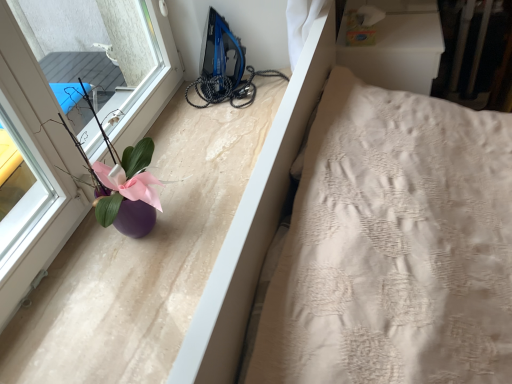
Question: Considering the positions of point (130, 175) and point (1, 59), is point (130, 175) closer or farther from the camera than point (1, 59)?

Choices:
 (A) closer
 (B) farther

Answer: (B)

Question: In terms of width, does purple glossy vase at left look wider or thinner when compared to purple matte vase at left?

Choices:
 (A) thin
 (B) wide

Answer: (B)

Question: From a real-world perspective, is purple glossy vase at left physically located above or below purple matte vase at left?

Choices:
 (A) below
 (B) above

Answer: (A)

Question: Does point (32, 97) appear closer or farther from the camera than point (110, 188)?

Choices:
 (A) closer
 (B) farther

Answer: (A)

Question: Relative to purple glossy vase at left, is purple matte vase at left in front or behind?

Choices:
 (A) front
 (B) behind

Answer: (A)

Question: Is purple matte vase at left spatially inside purple glossy vase at left, or outside of it?

Choices:
 (A) outside
 (B) inside

Answer: (A)

Question: From the image's perspective, is purple matte vase at left positioned above or below purple glossy vase at left?

Choices:
 (A) above
 (B) below

Answer: (A)